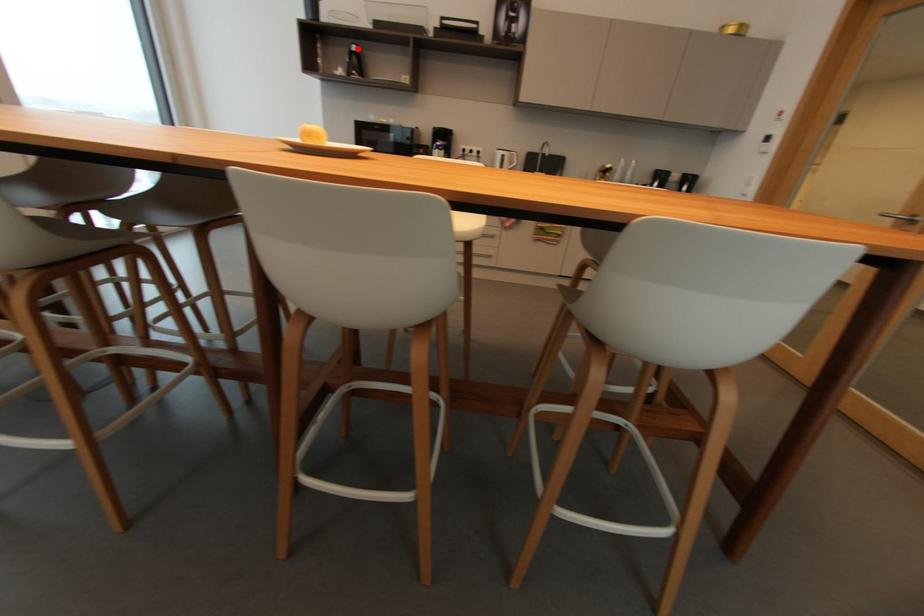
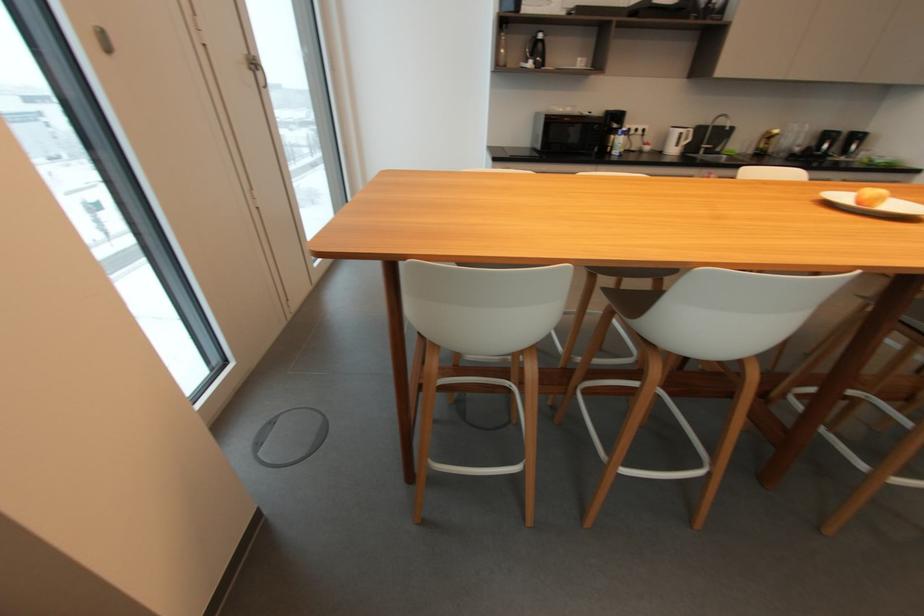
In the second image, find the point that corresponds to the highlighted location in the first image.

(544, 36)